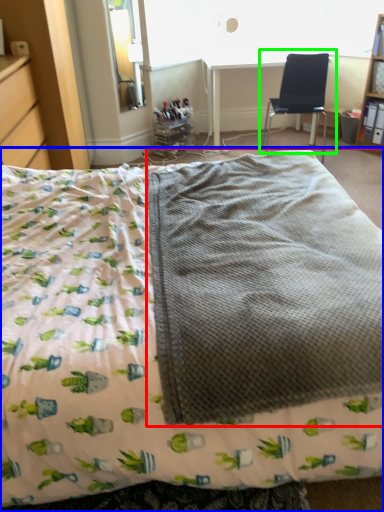
Question: Based on their relative distances, which object is nearer to blanket (highlighted by a red box)? Choose from bed (highlighted by a blue box) and chair (highlighted by a green box).

Choices:
 (A) bed
 (B) chair

Answer: (A)